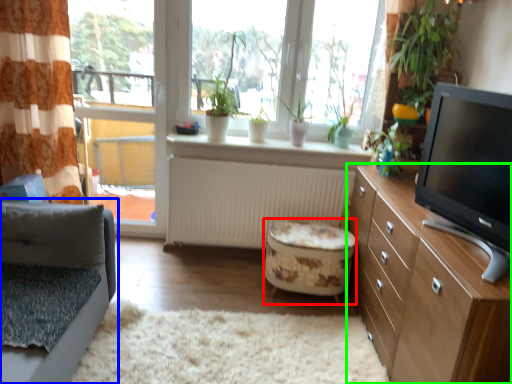
Question: Which object is the farthest from stool (highlighted by a red box)? Choose among these: studio couch (highlighted by a blue box) or cabinetry (highlighted by a green box).

Choices:
 (A) studio couch
 (B) cabinetry

Answer: (A)